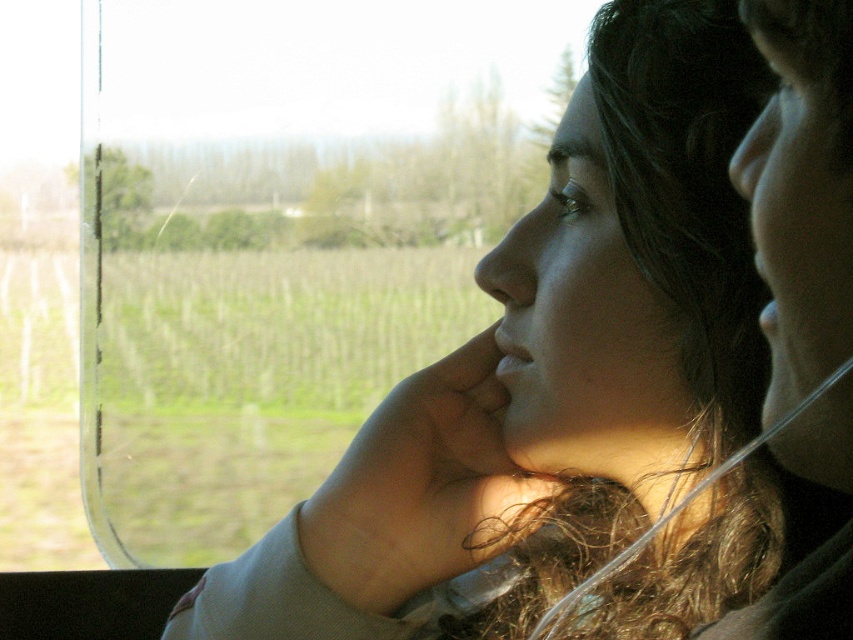
You are a photographer trying to capture a portrait of the smooth skin face at right and the matte skin nose at upper right. Which object should you focus on first to ensure both are in sharp focus?

The smooth skin face at right is closer to the viewer than the matte skin nose at upper right, so you should focus on the smooth skin face at right first to ensure both are in sharp focus.

Looking at this image, you are a delivery robot with a 25 cm wide package. You need to navigate between the matte gray sweater at center and the matte skin nose at upper right. Can you fit through the space between them?

The distance between the matte gray sweater at center and the matte skin nose at upper right is 24.90 centimeters. Since the package is 25 cm wide, it is slightly too wide to fit through the space between them.